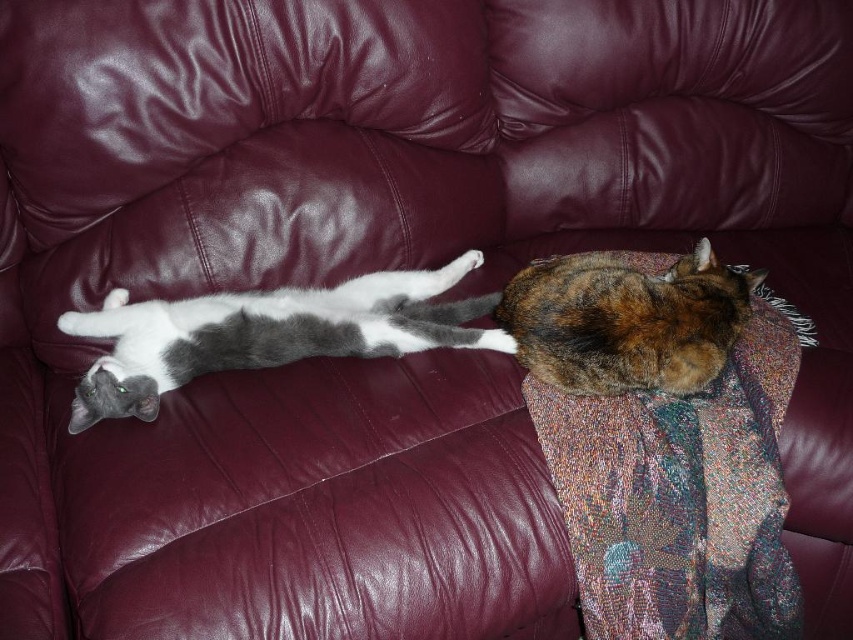
Who is lower down, white-gray fur cat at left or calico fur cat at right?

white-gray fur cat at left is below.

Does point (199, 321) come behind point (697, 276)?

No, it is in front of (697, 276).

Which is in front, point (218, 340) or point (721, 310)?

Point (721, 310) is more forward.

The width and height of the screenshot is (853, 640). I want to click on white-gray fur cat at left, so click(x=267, y=333).